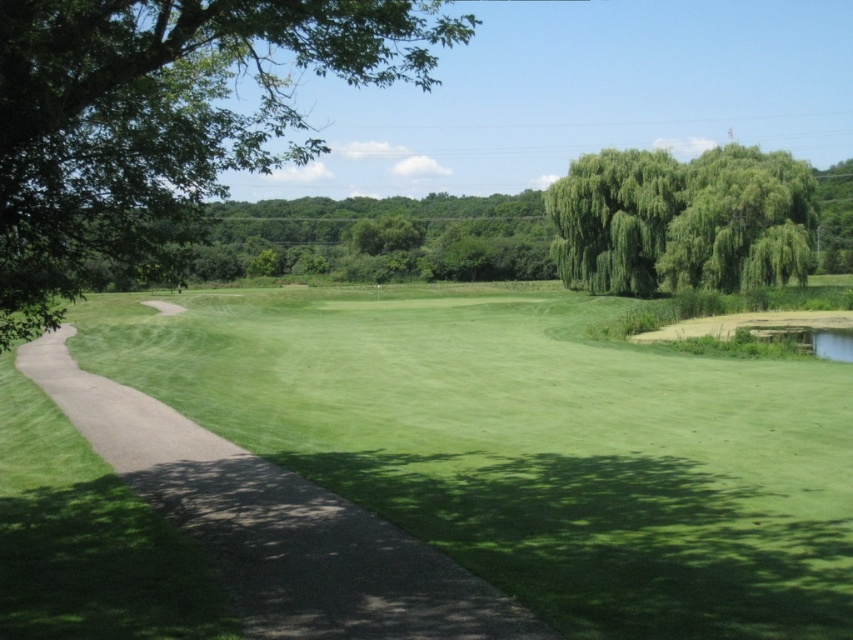
Which is behind, point (630, 291) or point (637, 257)?

The point (630, 291) is more distant.

Is green leafy tree at upper right wider than green leafy tree at upper center?

Yes.

The height and width of the screenshot is (640, 853). Find the location of `green leafy tree at upper right`. green leafy tree at upper right is located at coordinates pyautogui.click(x=682, y=220).

Can you confirm if green leafy tree at left is taller than green leafy tree at upper center?

Indeed, green leafy tree at left has a greater height compared to green leafy tree at upper center.

Is point (303, 154) closer to viewer compared to point (627, 273)?

No, it is behind (627, 273).

At what (x,y) coordinates should I click in order to perform the action: click on green leafy tree at left. Please return your answer as a coordinate pair (x, y). The width and height of the screenshot is (853, 640). Looking at the image, I should click on (161, 120).

From the picture: Between gray asphalt path at left and green leafy tree at upper right, which one has less height?

gray asphalt path at left is shorter.

Based on the photo, who is positioned more to the left, gray asphalt path at left or green leafy tree at upper right?

From the viewer's perspective, gray asphalt path at left appears more on the left side.

Does point (242, 566) come in front of point (799, 212)?

Yes.

The width and height of the screenshot is (853, 640). I want to click on gray asphalt path at left, so click(x=276, y=524).